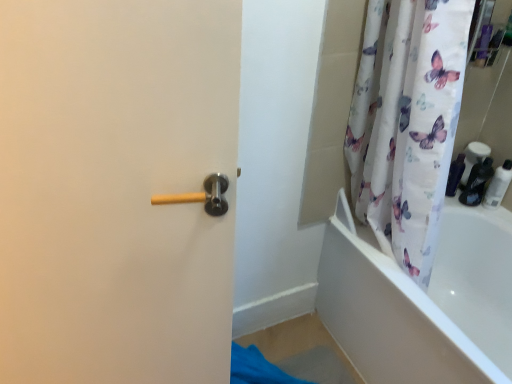
Describe the element at coordinates (455, 175) in the screenshot. I see `matte black bottle at right, the 3th toiletry when ordered from right to left` at that location.

The image size is (512, 384). What are the coordinates of `matte black bottle at right, the 3th toiletry when ordered from right to left` in the screenshot? It's located at (455, 175).

Locate an element on the screen. matte black bottle at right, which appears as the 1th toiletry when viewed from the left is located at coordinates (455, 175).

Considering the positions of objects matte black bottle at right, which appears as the 1th toiletry when viewed from the left, and matte black toiletries at right, which is counted as the second toiletry, starting from the right, in the image provided, who is behind, matte black bottle at right, which appears as the 1th toiletry when viewed from the left, or matte black toiletries at right, which is counted as the second toiletry, starting from the right,?

matte black bottle at right, which appears as the 1th toiletry when viewed from the left, is more distant.

Is point (450, 189) positioned behind point (505, 188)?

Yes, it is.

Considering the sizes of objects matte black bottle at right, which appears as the 1th toiletry when viewed from the left, and matte black toiletries at right, which is counted as the second toiletry, starting from the right, in the image provided, who is wider, matte black bottle at right, which appears as the 1th toiletry when viewed from the left, or matte black toiletries at right, which is counted as the second toiletry, starting from the right,?

With larger width is matte black toiletries at right, which is counted as the second toiletry, starting from the right.

In the scene shown: Is matte black bottle at right, the 3th toiletry when ordered from right to left, at the right side of matte black toiletries at right, the second toiletry viewed from the left?

In fact, matte black bottle at right, the 3th toiletry when ordered from right to left, is to the left of matte black toiletries at right, the second toiletry viewed from the left.

Considering the positions of objects white glossy bottle at right, the 1th toiletry positioned from the right, and matte black toiletries at right, the second toiletry viewed from the left, in the image provided, who is more to the left, white glossy bottle at right, the 1th toiletry positioned from the right, or matte black toiletries at right, the second toiletry viewed from the left,?

matte black toiletries at right, the second toiletry viewed from the left, is more to the left.

Considering the relative sizes of white glossy bottle at right, placed as the 3th toiletry when sorted from left to right, and matte black toiletries at right, the second toiletry viewed from the left, in the image provided, is white glossy bottle at right, placed as the 3th toiletry when sorted from left to right, thinner than matte black toiletries at right, the second toiletry viewed from the left,?

Yes, white glossy bottle at right, placed as the 3th toiletry when sorted from left to right, is thinner than matte black toiletries at right, the second toiletry viewed from the left.

Who is smaller, white glossy bottle at right, placed as the 3th toiletry when sorted from left to right, or matte black toiletries at right, the second toiletry viewed from the left?

Smaller between the two is white glossy bottle at right, placed as the 3th toiletry when sorted from left to right.

The width and height of the screenshot is (512, 384). Find the location of `toiletry that is below the matte black toiletries at right, the second toiletry viewed from the left (from the image's perspective)`. toiletry that is below the matte black toiletries at right, the second toiletry viewed from the left (from the image's perspective) is located at coordinates (498, 185).

How many degrees apart are the facing directions of matte black toiletries at right, the second toiletry viewed from the left, and white glossy bottle at right, placed as the 3th toiletry when sorted from left to right?

The facing directions of matte black toiletries at right, the second toiletry viewed from the left, and white glossy bottle at right, placed as the 3th toiletry when sorted from left to right, are 4.97 degrees apart.

Between matte black toiletries at right, which is counted as the second toiletry, starting from the right, and white glossy bottle at right, placed as the 3th toiletry when sorted from left to right, which one has smaller size?

Smaller between the two is white glossy bottle at right, placed as the 3th toiletry when sorted from left to right.

From the image's perspective, is matte black toiletries at right, the second toiletry viewed from the left, under white glossy bottle at right, the 1th toiletry positioned from the right?

No, from the image's perspective, matte black toiletries at right, the second toiletry viewed from the left, is not below white glossy bottle at right, the 1th toiletry positioned from the right.

Is the surface of matte black bottle at right, the 3th toiletry when ordered from right to left, in direct contact with white glossy bottle at right, the 1th toiletry positioned from the right?

No, matte black bottle at right, the 3th toiletry when ordered from right to left, is not making contact with white glossy bottle at right, the 1th toiletry positioned from the right.

From the image's perspective, is matte black bottle at right, the 3th toiletry when ordered from right to left, located above or below white glossy bottle at right, placed as the 3th toiletry when sorted from left to right?

From the image's perspective, matte black bottle at right, the 3th toiletry when ordered from right to left, appears above white glossy bottle at right, placed as the 3th toiletry when sorted from left to right.

Is point (459, 155) positioned behind point (505, 179)?

Yes, point (459, 155) is farther from viewer.

Is white glossy bottle at right, placed as the 3th toiletry when sorted from left to right, positioned with its back to matte black bottle at right, which appears as the 1th toiletry when viewed from the left?

No, white glossy bottle at right, placed as the 3th toiletry when sorted from left to right, is not facing away from matte black bottle at right, which appears as the 1th toiletry when viewed from the left.

From a real-world perspective, count 2nd toiletrys downward from the white glossy bottle at right, the 1th toiletry positioned from the right, and point to it. Please provide its 2D coordinates.

[(455, 175)]

Is white glossy bottle at right, placed as the 3th toiletry when sorted from left to right, beside matte black bottle at right, the 3th toiletry when ordered from right to left?

white glossy bottle at right, placed as the 3th toiletry when sorted from left to right, and matte black bottle at right, the 3th toiletry when ordered from right to left, are not in contact.

Measure the distance from white glossy bottle at right, the 1th toiletry positioned from the right, to matte black bottle at right, which appears as the 1th toiletry when viewed from the left.

5.81 inches.

Considering the sizes of objects matte black toiletries at right, which is counted as the second toiletry, starting from the right, and matte black bottle at right, the 3th toiletry when ordered from right to left, in the image provided, who is taller, matte black toiletries at right, which is counted as the second toiletry, starting from the right, or matte black bottle at right, the 3th toiletry when ordered from right to left,?

matte black toiletries at right, which is counted as the second toiletry, starting from the right, is taller.

Which is correct: matte black toiletries at right, the second toiletry viewed from the left, is inside matte black bottle at right, the 3th toiletry when ordered from right to left, or outside of it?

matte black toiletries at right, the second toiletry viewed from the left, is outside matte black bottle at right, the 3th toiletry when ordered from right to left.

How much distance is there between matte black toiletries at right, which is counted as the second toiletry, starting from the right, and matte black bottle at right, which appears as the 1th toiletry when viewed from the left?

matte black toiletries at right, which is counted as the second toiletry, starting from the right, and matte black bottle at right, which appears as the 1th toiletry when viewed from the left, are 2.39 inches apart from each other.

From a real-world perspective, does matte black toiletries at right, the second toiletry viewed from the left, stand above matte black bottle at right, which appears as the 1th toiletry when viewed from the left?

Yes, from a real-world perspective, matte black toiletries at right, the second toiletry viewed from the left, is above matte black bottle at right, which appears as the 1th toiletry when viewed from the left.

Find the location of a particular element. toiletry that is on the left side of matte black toiletries at right, the second toiletry viewed from the left is located at coordinates (455, 175).

The height and width of the screenshot is (384, 512). What are the coordinates of `toiletry located above the matte black toiletries at right, which is counted as the second toiletry, starting from the right (from a real-world perspective)` in the screenshot? It's located at (498, 185).

Which object lies nearer to the anchor point matte black toiletries at right, the second toiletry viewed from the left, matte black bottle at right, which appears as the 1th toiletry when viewed from the left, or white glossy bottle at right, the 1th toiletry positioned from the right?

The object closer to matte black toiletries at right, the second toiletry viewed from the left, is white glossy bottle at right, the 1th toiletry positioned from the right.

Estimate the real-world distances between objects in this image. Which object is closer to matte black bottle at right, which appears as the 1th toiletry when viewed from the left, white glossy bottle at right, placed as the 3th toiletry when sorted from left to right, or matte black toiletries at right, which is counted as the second toiletry, starting from the right?

matte black toiletries at right, which is counted as the second toiletry, starting from the right, is positioned closer to the anchor matte black bottle at right, which appears as the 1th toiletry when viewed from the left.

Considering their positions, is matte black toiletries at right, the second toiletry viewed from the left, positioned closer to matte black bottle at right, the 3th toiletry when ordered from right to left, than white glossy bottle at right, the 1th toiletry positioned from the right?

matte black toiletries at right, the second toiletry viewed from the left, is closer to matte black bottle at right, the 3th toiletry when ordered from right to left.

Estimate the real-world distances between objects in this image. Which object is further from matte black toiletries at right, the second toiletry viewed from the left, white glossy bottle at right, the 1th toiletry positioned from the right, or matte black bottle at right, which appears as the 1th toiletry when viewed from the left?

Based on the image, matte black bottle at right, which appears as the 1th toiletry when viewed from the left, appears to be further to matte black toiletries at right, the second toiletry viewed from the left.

Based on their spatial positions, is matte black toiletries at right, the second toiletry viewed from the left, or matte black bottle at right, the 3th toiletry when ordered from right to left, further from white glossy bottle at right, the 1th toiletry positioned from the right?

matte black bottle at right, the 3th toiletry when ordered from right to left, is further to white glossy bottle at right, the 1th toiletry positioned from the right.

Which object lies nearer to the anchor point white glossy bottle at right, placed as the 3th toiletry when sorted from left to right, matte black bottle at right, which appears as the 1th toiletry when viewed from the left, or matte black toiletries at right, the second toiletry viewed from the left?

Based on the image, matte black toiletries at right, the second toiletry viewed from the left, appears to be nearer to white glossy bottle at right, placed as the 3th toiletry when sorted from left to right.

Where is `toiletry situated between matte black bottle at right, which appears as the 1th toiletry when viewed from the left, and white glossy bottle at right, the 1th toiletry positioned from the right, from left to right`? toiletry situated between matte black bottle at right, which appears as the 1th toiletry when viewed from the left, and white glossy bottle at right, the 1th toiletry positioned from the right, from left to right is located at coordinates (476, 170).